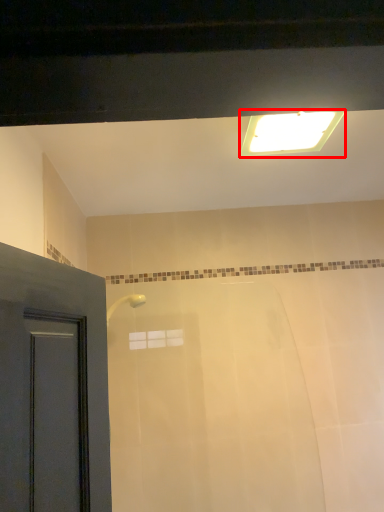
Question: From the image's perspective, where is lighting (annotated by the red box) located relative to bath?

Choices:
 (A) below
 (B) above

Answer: (B)